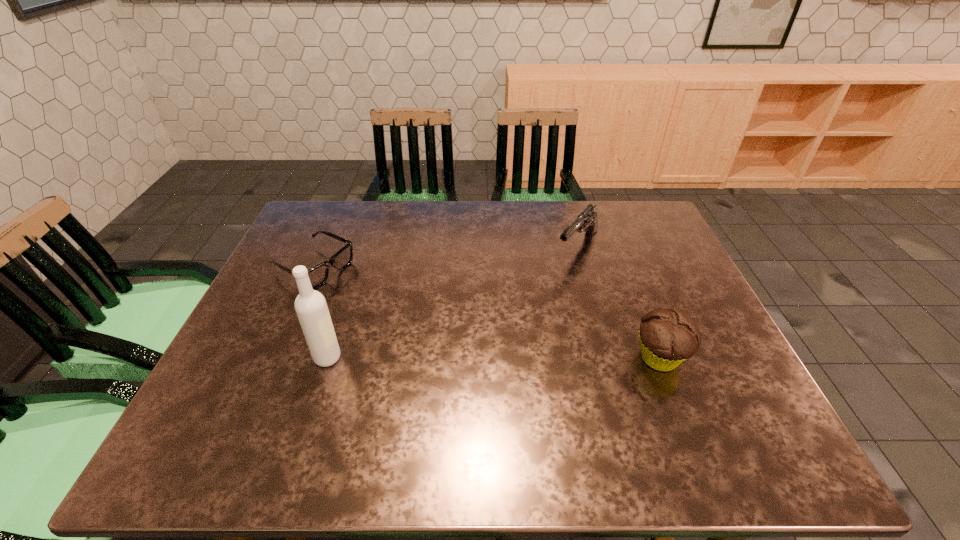
At what (x,y) coordinates should I click in order to perform the action: click on free space on the desktop that is between the tallest object and the muffin and is positioned at the end of the barrel of the gun. Please return your answer as a coordinate pair (x, y). Looking at the image, I should click on (475, 358).

I want to click on vacant spot on the desktop that is between the vodka and the muffin and is positioned on the front-facing side of the sunglasses, so click(484, 358).